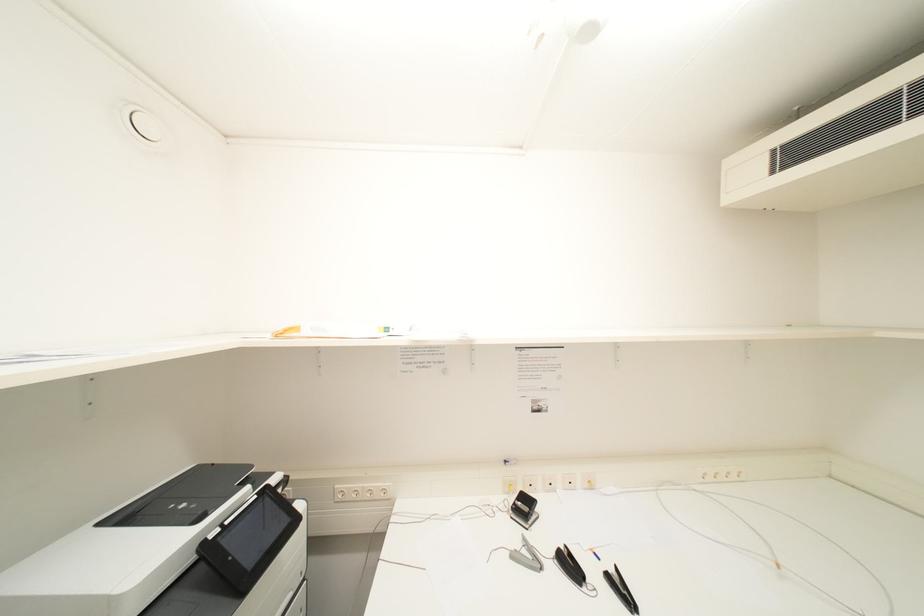
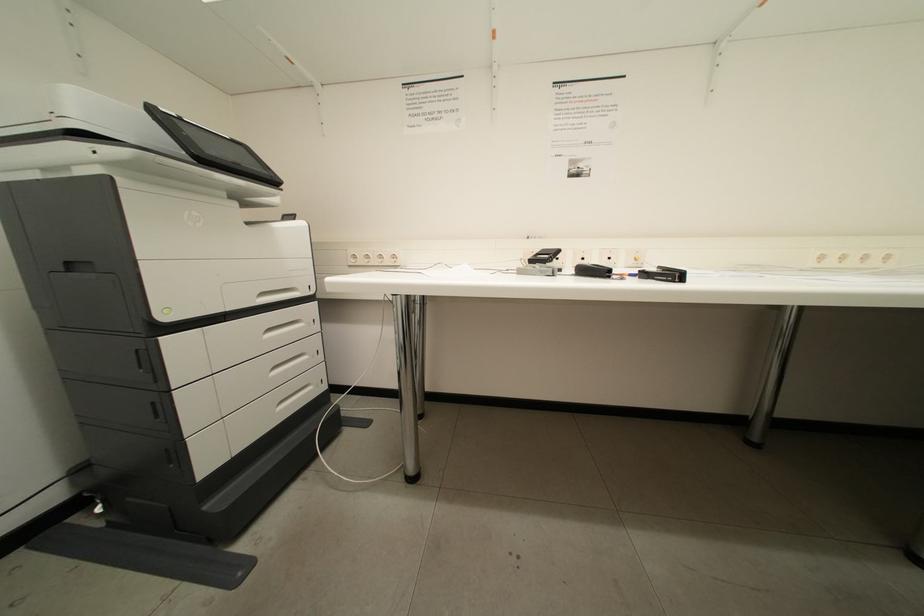
The images are taken continuously from a first-person perspective. In which direction are you moving?

The cameraman moved toward right, forward.